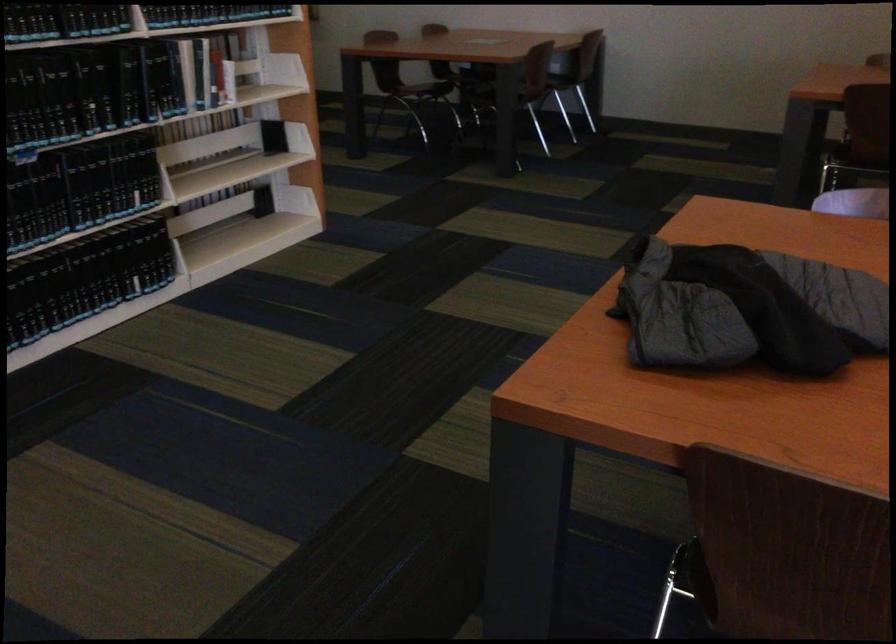
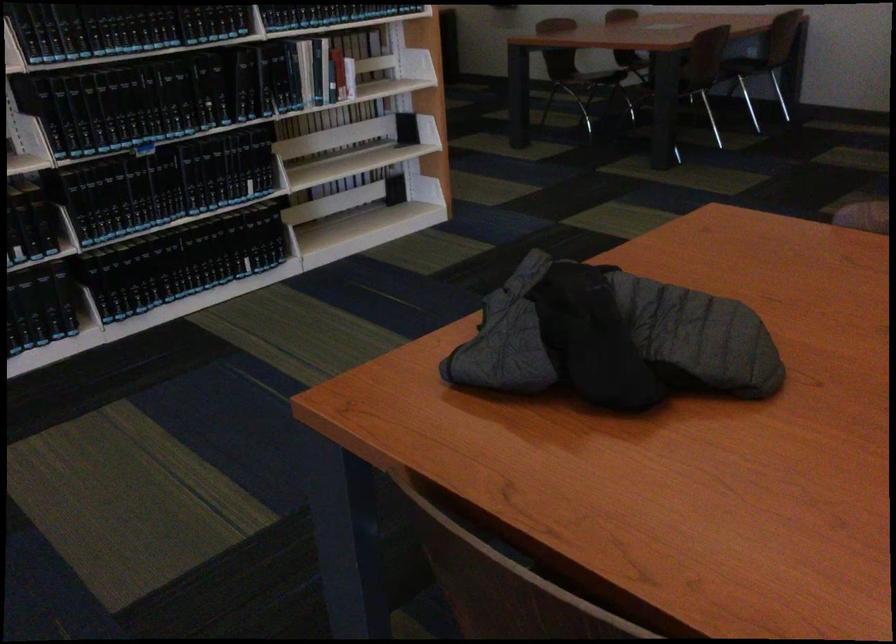
In the second image, find the point that corresponds to [135,80] in the first image.

(248, 82)